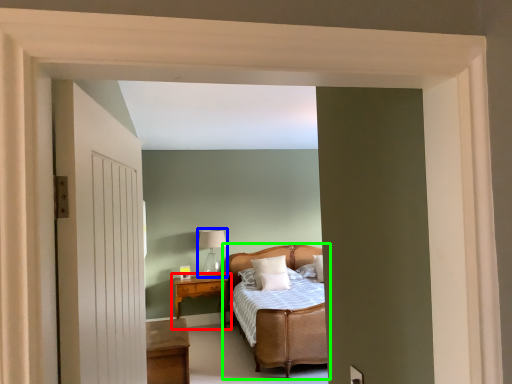
Question: Which object is positioned closest to nightstand (highlighted by a red box)? Select from table lamp (highlighted by a blue box) and bed (highlighted by a green box).

Choices:
 (A) table lamp
 (B) bed

Answer: (A)